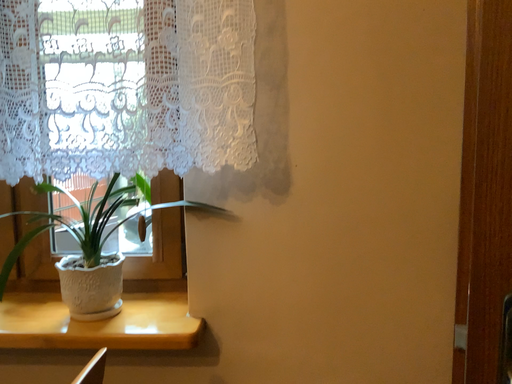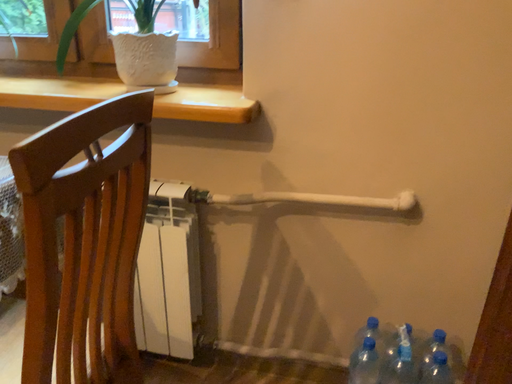
Question: How did the camera likely rotate when shooting the video?

Choices:
 (A) rotated downward
 (B) rotated upward

Answer: (A)